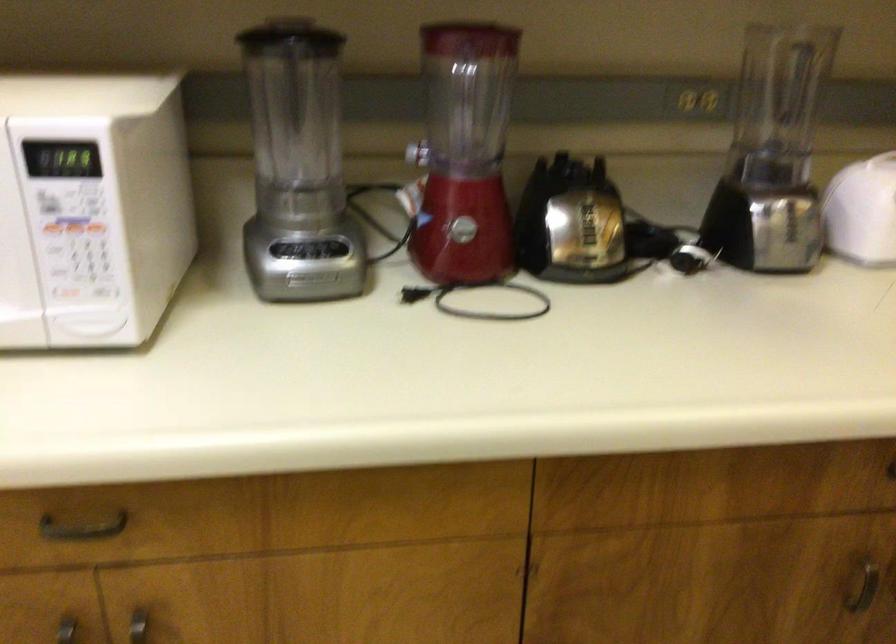
What do you see at coordinates (309, 278) in the screenshot? The width and height of the screenshot is (896, 644). I see `the silver blender dial` at bounding box center [309, 278].